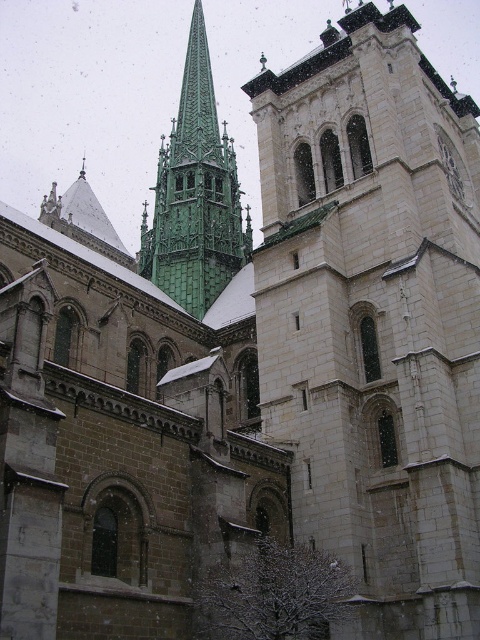
You are an architect designing a model of the cathedral. You need to ensure the white stone tower at center and the green stone spire at upper left are proportionally accurate. Which structure should you make wider in your model?

The white stone tower at center should be made wider in the model since its width is larger than the green stone spire at upper left according to the description.

You are standing in front of the cathedral and want to take a photo that includes both the white stone tower at center and the green stone spire at upper left. Based on their positions, which one should you pan your camera towards first to ensure both are in frame?

You should pan your camera towards the green stone spire at upper left first because the white stone tower at center is positioned to its right, so starting with the leftmost object ensures both are captured in the frame.